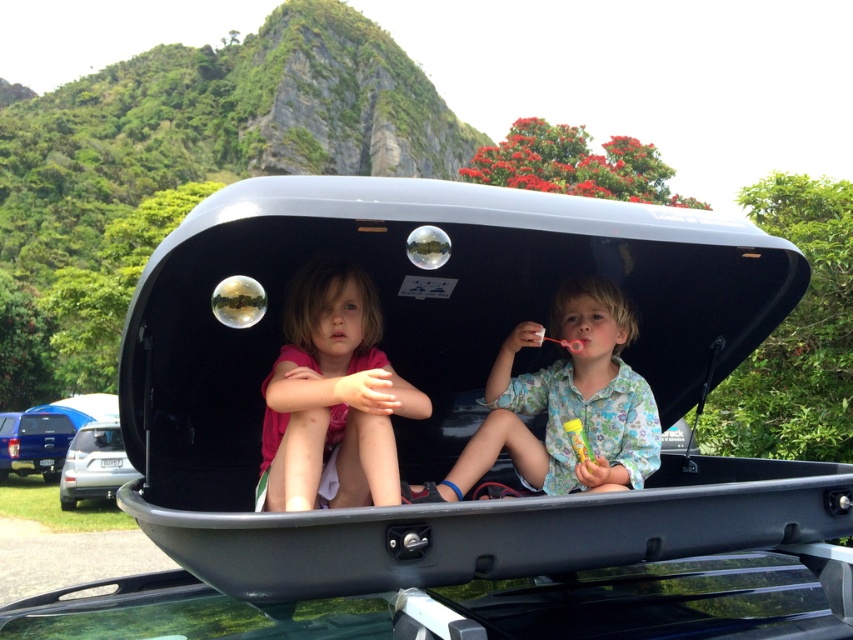
You are a tailor trying to decide which fabric to use for a new dress pattern. You have two options in the image, the pink fabric at center and the floral fabric shirt at center. Based on their thickness, which one is more suitable for a summer dress that requires lightweight material?

The pink fabric at center is thinner than the floral fabric shirt at center, making it more suitable for a summer dress that requires lightweight material.

You are a photographer standing in the scene. You want to take a photo of the blue metallic truck at lower left without the pink fabric at center blocking the view. Where should you position yourself to ensure the truck is fully visible?

The pink fabric at center is above the blue metallic truck at lower left, so you should position yourself below the truck to avoid the fabric blocking the view.